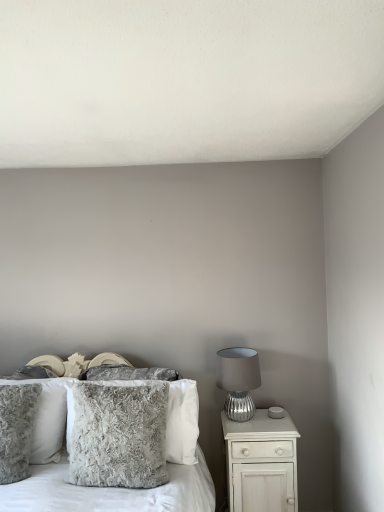
Locate an element on the screen. fluffy gray pillow at left, positioned as the 4th pillow in front-to-back order is located at coordinates (48, 418).

What is the approximate height of white glossy nightstand at right?

26.84 inches.

This screenshot has width=384, height=512. What do you see at coordinates (261, 463) in the screenshot? I see `white glossy nightstand at right` at bounding box center [261, 463].

The width and height of the screenshot is (384, 512). What do you see at coordinates (167, 407) in the screenshot?
I see `fuzzy gray pillow at center, positioned as the second pillow in back-to-front order` at bounding box center [167, 407].

The width and height of the screenshot is (384, 512). What are the coordinates of `fuzzy gray pillow at center` in the screenshot? It's located at (98, 487).

From a real-world perspective, relative to fuzzy gray pillow at center, is fuzzy gray pillow at center, which is the 3th pillow in front-to-back order, vertically above or below?

fuzzy gray pillow at center, which is the 3th pillow in front-to-back order, is above fuzzy gray pillow at center.

Is fuzzy gray pillow at center inside fuzzy gray pillow at center, positioned as the second pillow in back-to-front order?

No, fuzzy gray pillow at center is not a part of fuzzy gray pillow at center, positioned as the second pillow in back-to-front order.

Is fuzzy gray pillow at center, which is the 3th pillow in front-to-back order, next to fuzzy gray pillow at center and touching it?

They are not placed beside each other.

How many degrees apart are the facing directions of fuzzy gray pillow at center, which is the 3th pillow in front-to-back order, and fuzzy gray pillow at center?

1.74 degrees.

Locate an element on the screen. The height and width of the screenshot is (512, 384). the 3rd pillow positioned below the silver textured lamp at right (from a real-world perspective) is located at coordinates (167, 407).

In the scene shown: Considering the relative positions of fuzzy gray pillow at center, which is the 3th pillow in front-to-back order, and silver textured lamp at right in the image provided, is fuzzy gray pillow at center, which is the 3th pillow in front-to-back order, to the left or to the right of silver textured lamp at right?

fuzzy gray pillow at center, which is the 3th pillow in front-to-back order, is positioned on silver textured lamp at right's left side.

From the image's perspective, which one is positioned higher, fuzzy gray pillow at center, positioned as the second pillow in back-to-front order, or silver textured lamp at right?

silver textured lamp at right is shown above in the image.

From the picture: Could you tell me if fuzzy gray pillow at center, positioned as the second pillow in back-to-front order, is facing silver textured lamp at right?

No, fuzzy gray pillow at center, positioned as the second pillow in back-to-front order, does not turn towards silver textured lamp at right.

Which object is positioned more to the left, white glossy nightstand at right or silver textured lamp at right?

silver textured lamp at right is more to the left.

Considering the sizes of white glossy nightstand at right and silver textured lamp at right in the image, is white glossy nightstand at right taller or shorter than silver textured lamp at right?

Considering their sizes, white glossy nightstand at right has more height than silver textured lamp at right.

From the picture: Can we say white glossy nightstand at right lies outside silver textured lamp at right?

Yes, white glossy nightstand at right is located beyond the bounds of silver textured lamp at right.

From a real-world perspective, relative to silver textured lamp at right, is white glossy nightstand at right vertically above or below?

In terms of real-world spatial position, white glossy nightstand at right is below silver textured lamp at right.

Are fuzzy gray pillow at center, which is the first pillow in front-to-back order, and fuzzy gray pillow at center making contact?

No, fuzzy gray pillow at center, which is the first pillow in front-to-back order, is not touching fuzzy gray pillow at center.

Which is more to the right, fuzzy gray pillow at center, the 4th pillow viewed from the back, or fuzzy gray pillow at center?

fuzzy gray pillow at center, the 4th pillow viewed from the back.

Is fuzzy gray pillow at center a part of fuzzy gray pillow at center, which is the first pillow in front-to-back order?

No, fuzzy gray pillow at center is not surrounded by fuzzy gray pillow at center, which is the first pillow in front-to-back order.

From the image's perspective, is fuzzy gray pillow at center, which is the first pillow in front-to-back order, positioned above or below fuzzy gray pillow at center?

Clearly, from the image's perspective, fuzzy gray pillow at center, which is the first pillow in front-to-back order, is above fuzzy gray pillow at center.

Between fuzzy gray pillow at center, which is the first pillow in front-to-back order, and fuzzy gray pillow at left, positioned as the 2th pillow in front-to-back order, which one has smaller width?

Thinner between the two is fuzzy gray pillow at center, which is the first pillow in front-to-back order.

Is point (104, 420) positioned behind point (3, 477)?

No, (104, 420) is in front of (3, 477).

Between fuzzy gray pillow at center, the 4th pillow viewed from the back, and fuzzy gray pillow at left, positioned as the 2th pillow in front-to-back order, which one is positioned behind?

fuzzy gray pillow at left, positioned as the 2th pillow in front-to-back order, is further from the camera.

Which of these two, fuzzy gray pillow at left, positioned as the 2th pillow in front-to-back order, or fluffy gray pillow at left, which ranks as the first pillow in back-to-front order, is bigger?

fluffy gray pillow at left, which ranks as the first pillow in back-to-front order, is bigger.

Is point (10, 476) closer to viewer compared to point (39, 418)?

Yes, it is.

From a real-world perspective, which is physically above, fuzzy gray pillow at left, the 3th pillow when ordered from back to front, or fluffy gray pillow at left, positioned as the 4th pillow in front-to-back order?

From a 3D spatial view, fuzzy gray pillow at left, the 3th pillow when ordered from back to front, is above.

Would you say fluffy gray pillow at left, positioned as the 4th pillow in front-to-back order, is part of fuzzy gray pillow at left, positioned as the 2th pillow in front-to-back order,'s contents?

Definitely not — fluffy gray pillow at left, positioned as the 4th pillow in front-to-back order, is not inside fuzzy gray pillow at left, positioned as the 2th pillow in front-to-back order.

Which object is more forward, fluffy gray pillow at left, which ranks as the first pillow in back-to-front order, or fuzzy gray pillow at center, which is the 3th pillow in front-to-back order?

fuzzy gray pillow at center, which is the 3th pillow in front-to-back order, is closer to the camera.

Considering the positions of points (52, 414) and (182, 393), is point (52, 414) closer to camera compared to point (182, 393)?

No, (52, 414) is behind (182, 393).

Locate an element on the screen. The image size is (384, 512). bed lying in front of the fuzzy gray pillow at center, positioned as the second pillow in back-to-front order is located at coordinates click(98, 487).

You are a GUI agent. You are given a task and a screenshot of the screen. Output one action in this format:
    pyautogui.click(x=<x>, y=<y>)
    Task: Click on the pillow that is the 1st object to the left of the silver textured lamp at right, starting at the anchor
    This screenshot has width=384, height=512.
    Given the screenshot: What is the action you would take?
    pyautogui.click(x=167, y=407)

Based on their spatial positions, is fuzzy gray pillow at center, which is the first pillow in front-to-back order, or fluffy gray pillow at left, positioned as the 4th pillow in front-to-back order, closer to white glossy nightstand at right?

fuzzy gray pillow at center, which is the first pillow in front-to-back order, is closer to white glossy nightstand at right.

Based on their spatial positions, is fuzzy gray pillow at center, which is the first pillow in front-to-back order, or white glossy nightstand at right closer to fluffy gray pillow at left, which ranks as the first pillow in back-to-front order?

The object closer to fluffy gray pillow at left, which ranks as the first pillow in back-to-front order, is fuzzy gray pillow at center, which is the first pillow in front-to-back order.

Which object lies further to the anchor point fluffy gray pillow at left, which ranks as the first pillow in back-to-front order, silver textured lamp at right or white glossy nightstand at right?

Among the two, white glossy nightstand at right is located further to fluffy gray pillow at left, which ranks as the first pillow in back-to-front order.

From the image, which object appears to be farther from fuzzy gray pillow at left, positioned as the 2th pillow in front-to-back order, fluffy gray pillow at left, which ranks as the first pillow in back-to-front order, or fuzzy gray pillow at center, which is the 3th pillow in front-to-back order?

Based on the image, fuzzy gray pillow at center, which is the 3th pillow in front-to-back order, appears to be further to fuzzy gray pillow at left, positioned as the 2th pillow in front-to-back order.

Which object lies nearer to the anchor point fluffy gray pillow at left, positioned as the 4th pillow in front-to-back order, fuzzy gray pillow at center, positioned as the second pillow in back-to-front order, or fuzzy gray pillow at left, the 3th pillow when ordered from back to front?

Among the two, fuzzy gray pillow at left, the 3th pillow when ordered from back to front, is located nearer to fluffy gray pillow at left, positioned as the 4th pillow in front-to-back order.

In the scene shown: When comparing their distances from fuzzy gray pillow at center, does fuzzy gray pillow at left, the 3th pillow when ordered from back to front, or white glossy nightstand at right seem closer?

Based on the image, fuzzy gray pillow at left, the 3th pillow when ordered from back to front, appears to be nearer to fuzzy gray pillow at center.

Looking at this image, looking at the image, which one is located closer to fuzzy gray pillow at center, fuzzy gray pillow at center, positioned as the second pillow in back-to-front order, or fluffy gray pillow at left, which ranks as the first pillow in back-to-front order?

fluffy gray pillow at left, which ranks as the first pillow in back-to-front order, is closer to fuzzy gray pillow at center.

Which object lies further to the anchor point fuzzy gray pillow at center, positioned as the second pillow in back-to-front order, fuzzy gray pillow at center or fuzzy gray pillow at center, the 4th pillow viewed from the back?

fuzzy gray pillow at center is positioned further to the anchor fuzzy gray pillow at center, positioned as the second pillow in back-to-front order.

Image resolution: width=384 pixels, height=512 pixels. I want to click on pillow between fuzzy gray pillow at center and fuzzy gray pillow at left, the 3th pillow when ordered from back to front, along the z-axis, so click(x=119, y=435).

Where is `table lamp between fuzzy gray pillow at center, the 4th pillow viewed from the back, and white glossy nightstand at right from left to right`? This screenshot has width=384, height=512. table lamp between fuzzy gray pillow at center, the 4th pillow viewed from the back, and white glossy nightstand at right from left to right is located at coordinates (238, 380).

Identify the location of nightstand located between fuzzy gray pillow at center and silver textured lamp at right in the depth direction. This screenshot has height=512, width=384. (261, 463).

Where is `table lamp situated between fuzzy gray pillow at center, positioned as the second pillow in back-to-front order, and white glossy nightstand at right from left to right`? The image size is (384, 512). table lamp situated between fuzzy gray pillow at center, positioned as the second pillow in back-to-front order, and white glossy nightstand at right from left to right is located at coordinates (238, 380).